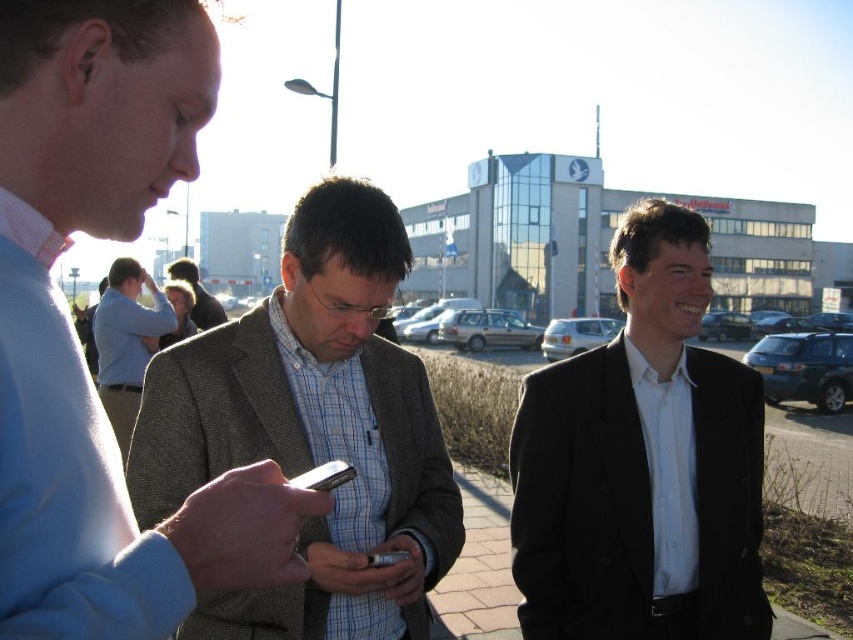
Based on the photo, you are standing in the outdoor scene and want to reach both the point at coordinates (541, 515) and the point at coordinates (200, 310). Which point will you reach first if you move straight ahead?

You will reach the point at coordinates (541, 515) first because it is closer to you than the point at coordinates (200, 310).

You are a photographer standing at the center of the scene. You want to take a photo that includes both the black matte suit at right and the light blue shirt at center. What is the minimum distance you need to move backward to ensure both subjects are in frame?

The black matte suit at right and the light blue shirt at center are 5.02 meters apart. To include both in the frame, you need to move backward until the camera can capture a field of view that spans at least 5.02 meters between them. The exact distance depends on the camera lens, but generally, increasing distance decreases the required field of view angle.